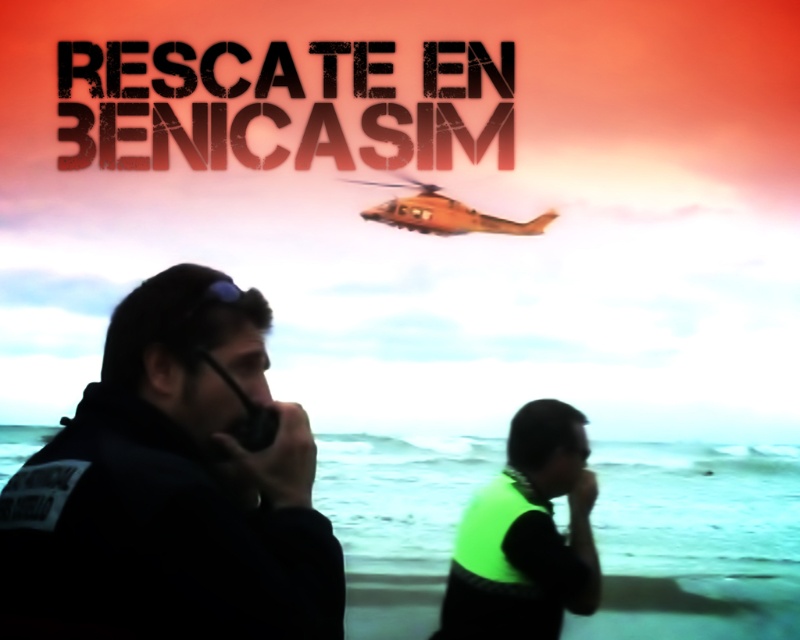
Is black fabric uniform at left bigger than black matte phone at center?

Indeed, black fabric uniform at left has a larger size compared to black matte phone at center.

Is point (274, 458) positioned behind point (240, 440)?

No, (274, 458) is closer to viewer.

I want to click on black fabric uniform at left, so click(x=172, y=486).

Who is more distant from viewer, (334, 566) or (470, 602)?

Positioned behind is point (470, 602).

Is point (134, 556) positioned in front of point (496, 520)?

Yes, point (134, 556) is closer to viewer.

Find the location of a particular element. The image size is (800, 640). black fabric uniform at left is located at coordinates (172, 486).

Is neon green vest at center below black matte phone at center?

Yes, neon green vest at center is below black matte phone at center.

Does point (572, 448) come in front of point (256, 412)?

No, it is not.

Does point (492, 588) lie in front of point (240, 426)?

No, (492, 588) is further to viewer.

Identify the location of neon green vest at center. (525, 536).